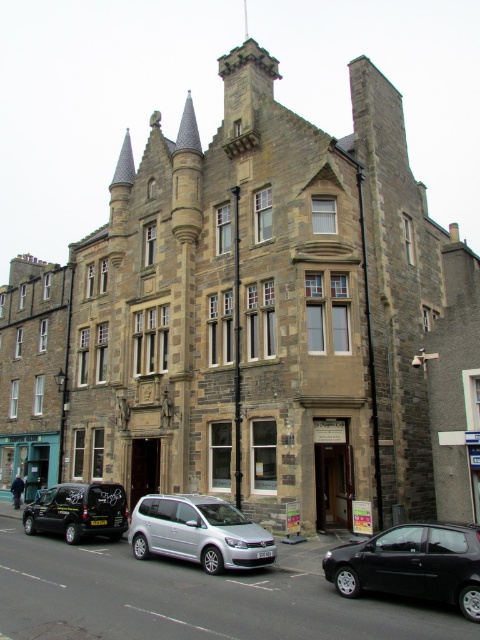
You are a delivery driver who needs to park your van in a parking lot adjacent to the multi story stone building. The parking space is 8 meters wide. You have a silver metallic van at center and a black matte van at lower left. Can both vans fit side by side in the parking space?

The distance between the silver metallic van at center and black matte van at lower left is 7.72 meters, so yes, both vans can fit side by side in the parking space since the total width required is less than the 8 meters available.

You are a delivery driver who needs to park your van in a spot that can accommodate both your vehicle and another car. You see the black matte hatchback at lower right and the silver metallic van at center. Can you determine if there is enough space between them to park your van?

The black matte hatchback at lower right and silver metallic van at center are 8.28 meters apart. Since the distance between them is sufficient to accommodate both vehicles, you can park your van in the available space between them.